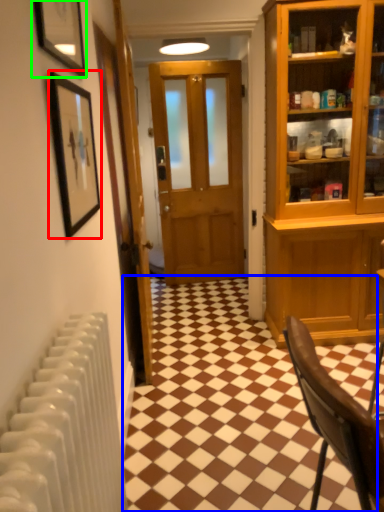
Question: Which object is the farthest from picture frame (highlighted by a red box)? Choose among these: tile (highlighted by a blue box) or picture frame (highlighted by a green box).

Choices:
 (A) tile
 (B) picture frame

Answer: (A)